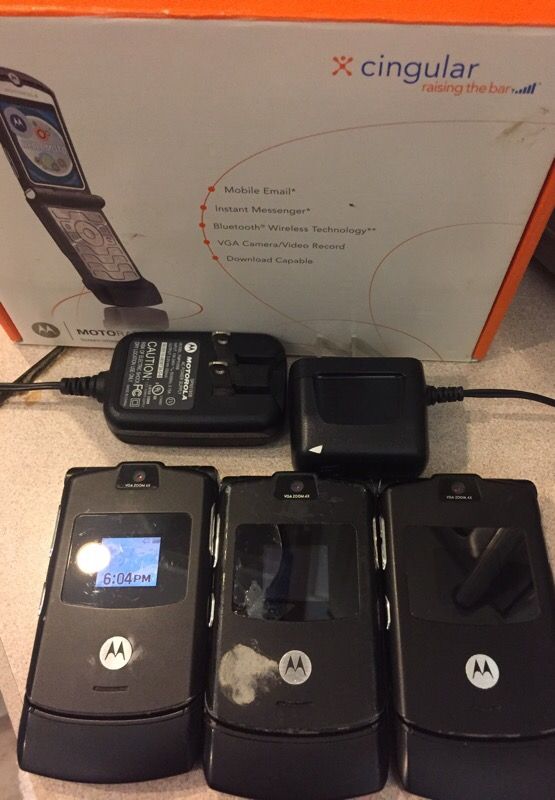
Identify the location of box. The height and width of the screenshot is (800, 555). (297, 168).